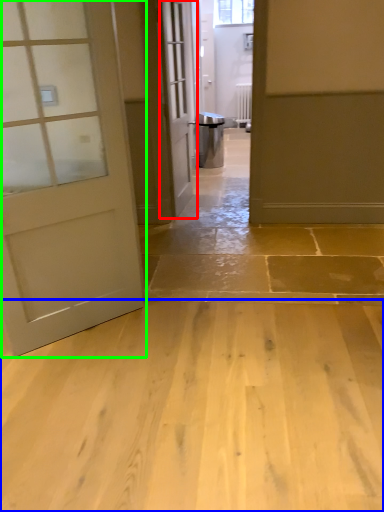
Question: Which object is the farthest from door (highlighted by a red box)? Choose among these: concrete (highlighted by a blue box) or door (highlighted by a green box).

Choices:
 (A) concrete
 (B) door

Answer: (A)